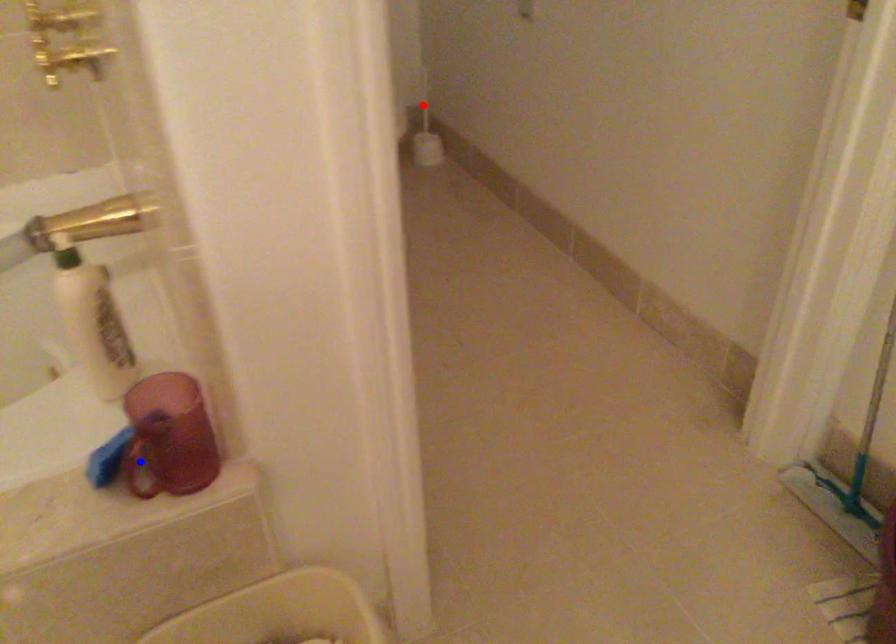
Question: Two points are marked on the image. Which point is closer to the camera?

Choices:
 (A) Blue point is closer.
 (B) Red point is closer.

Answer: (A)